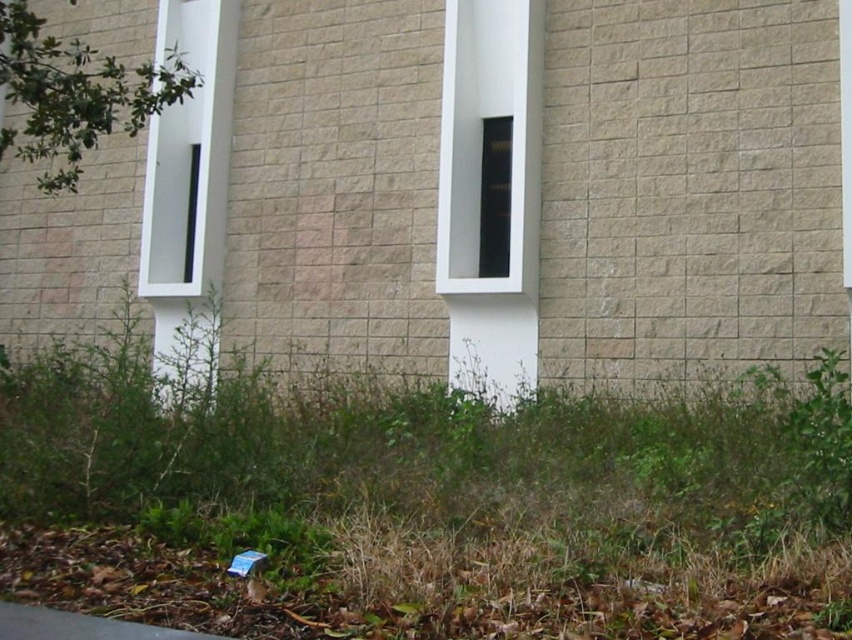
You are a maintenance worker inspecting the exterior wall. You notice a point marked at coordinates [481,138]. Based on the scene description, what object is located at that point?

The point at coordinates [481,138] marks the white glossy window at center.

You are standing in front of the building wall and want to locate two points marked on the image. Which of the two points, point (39,444) or point (522,108), is closer to you?

Point (39,444) is closer to the viewer than point (522,108).

You are standing in front of the building and want to walk towards the white glossy window at center. Which direction should you move relative to the green grass at lower center?

You should move to the right relative to the green grass at lower center because the white glossy window at center is to the right of the green grass at lower center.